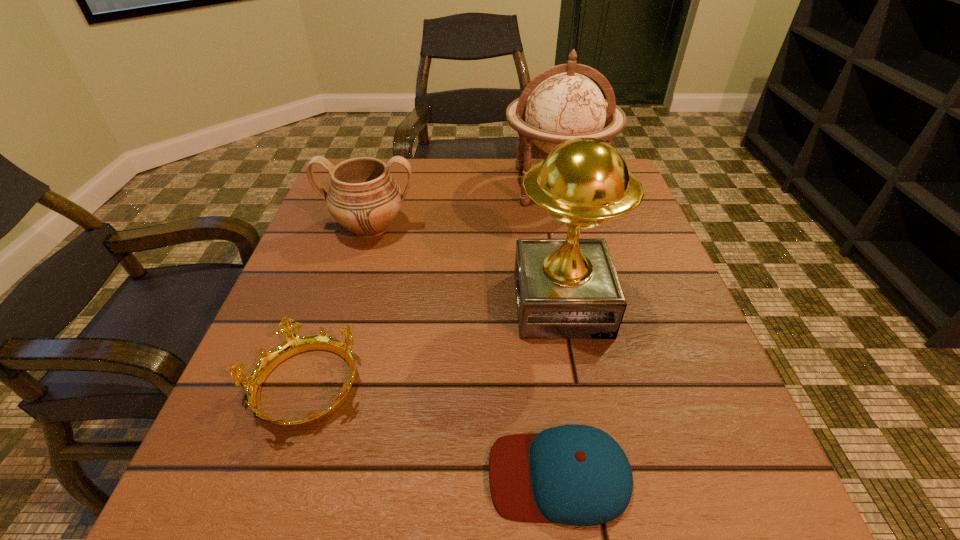
At what (x,y) coordinates should I click in order to perform the action: click on free space located 0.170m on the back of the second shortest object. Please return your answer as a coordinate pair (x, y). Looking at the image, I should click on (342, 275).

Find the location of `free region located with the bill of the shortest object facing forward`. free region located with the bill of the shortest object facing forward is located at coordinates (254, 475).

Where is `blank space located 0.230m with the bill of the shortest object facing forward`? The image size is (960, 540). blank space located 0.230m with the bill of the shortest object facing forward is located at coordinates (315, 475).

Identify the location of free space located with the bill of the shortest object facing forward. This screenshot has height=540, width=960. (383, 475).

At what (x,y) coordinates should I click in order to perform the action: click on globe at the far edge. Please return your answer as a coordinate pair (x, y). The width and height of the screenshot is (960, 540). Looking at the image, I should click on (565, 105).

Image resolution: width=960 pixels, height=540 pixels. What are the coordinates of `urn that is at the far edge` in the screenshot? It's located at (363, 197).

Image resolution: width=960 pixels, height=540 pixels. I want to click on object present at the near edge, so click(x=578, y=475).

This screenshot has width=960, height=540. What are the coordinates of `urn present at the left edge` in the screenshot? It's located at (363, 197).

Image resolution: width=960 pixels, height=540 pixels. I want to click on crown that is at the left edge, so [294, 344].

Find the location of a particular element. The width and height of the screenshot is (960, 540). globe located in the right edge section of the desktop is located at coordinates (565, 105).